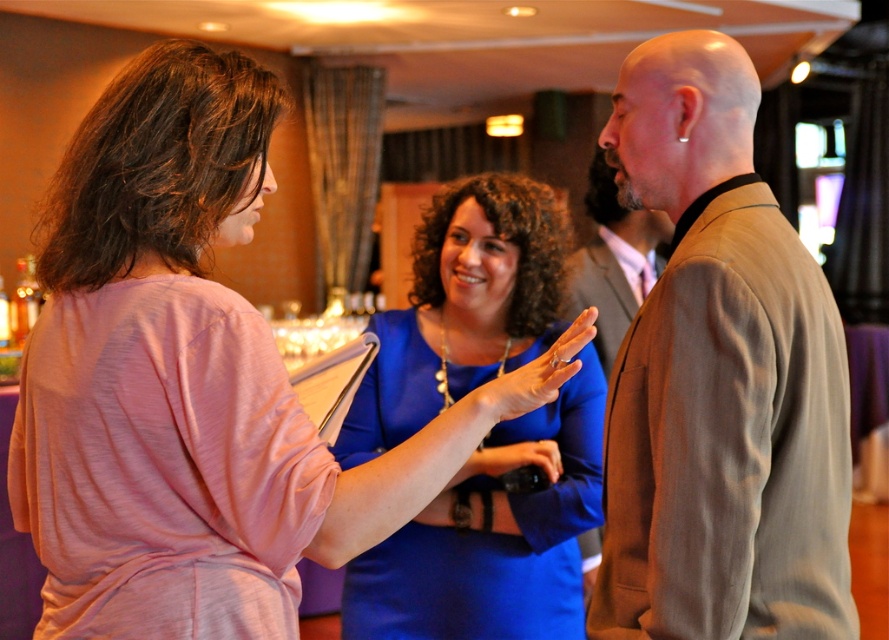
Question: Which is farther from the light brown jacket at center?

Choices:
 (A) brown textured suit at center
 (B) matte black camera at center

Answer: (A)

Question: Which object appears farthest from the camera in this image?

Choices:
 (A) matte black camera at center
 (B) brown textured suit at center

Answer: (B)

Question: From the image, what is the correct spatial relationship of light brown jacket at center in relation to brown textured suit at center?

Choices:
 (A) below
 (B) above

Answer: (A)

Question: Which point is closer to the camera?

Choices:
 (A) matte pink hand at center
 (B) pink fabric dress at center

Answer: (B)

Question: Is pink fabric dress at center to the left of matte pink hand at center from the viewer's perspective?

Choices:
 (A) no
 (B) yes

Answer: (B)

Question: Is light brown jacket at center further to the viewer compared to matte pink hand at center?

Choices:
 (A) no
 (B) yes

Answer: (B)